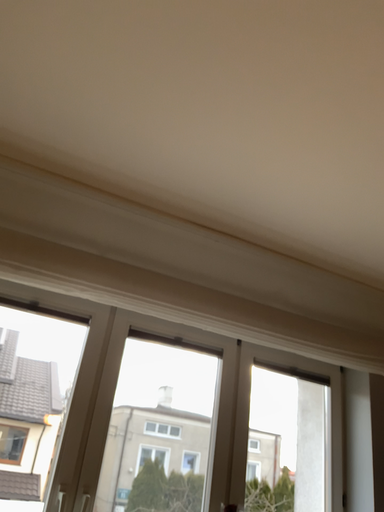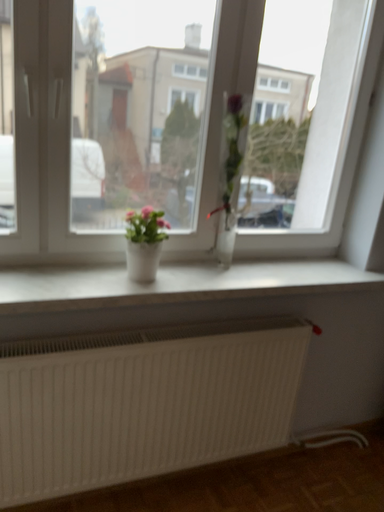
Question: Which way did the camera rotate in the video?

Choices:
 (A) rotated downward
 (B) rotated upward

Answer: (A)